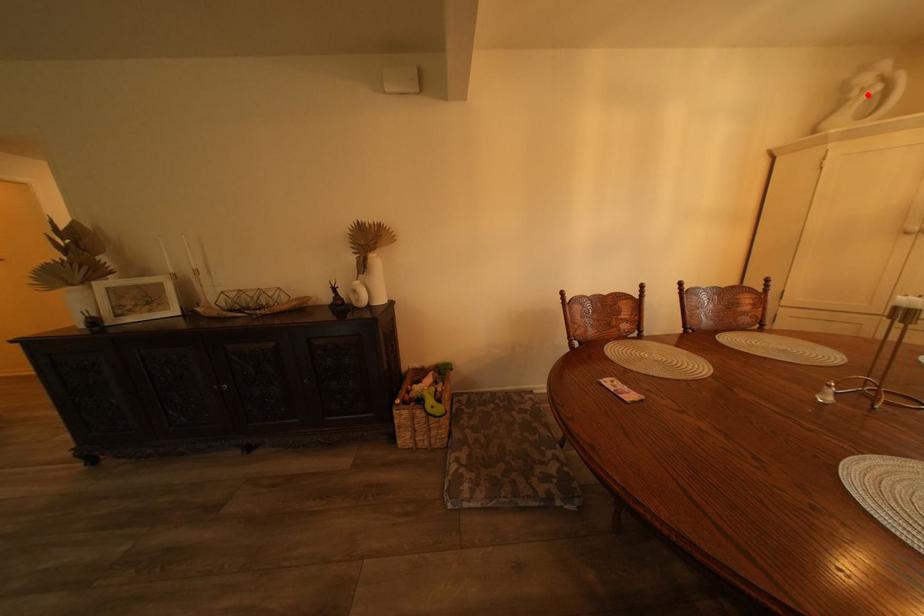
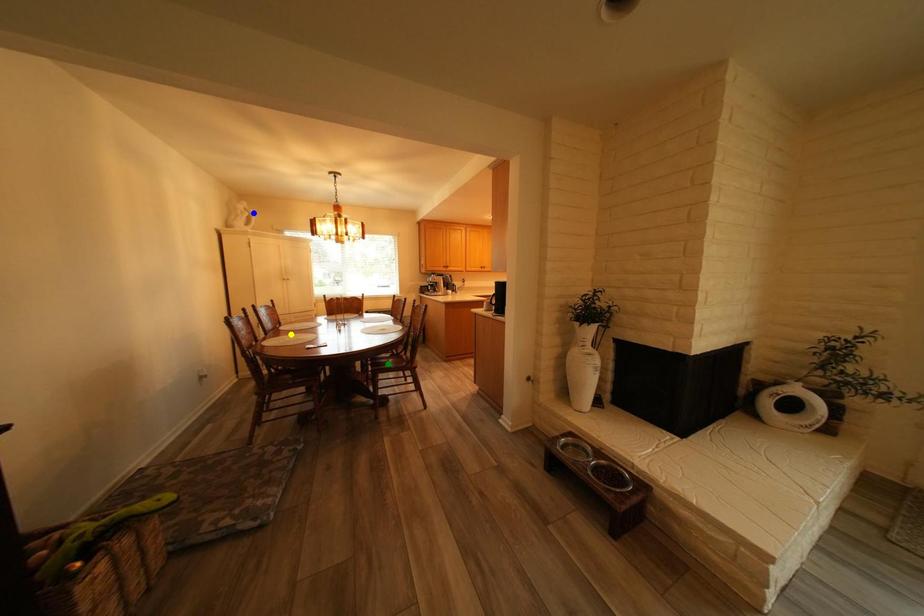
Question: I am providing you with two images of the same scene from different viewpoints. A red point is marked on the first image. You are given multiple points on the second image. In image 2, which mark is for the same physical point as the one in image 1?

Choices:
 (A) blue point
 (B) green point
 (C) yellow point

Answer: (A)